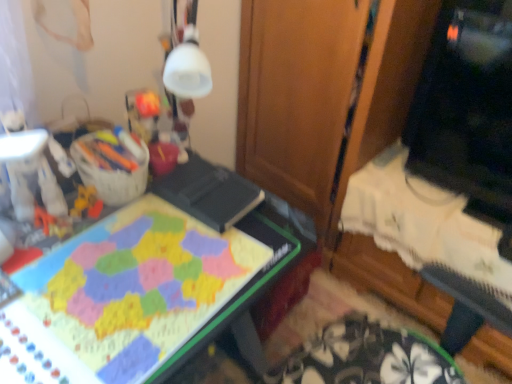
Question: Is matte plastic board game at center outside of black glossy monitor at upper right?

Choices:
 (A) no
 (B) yes

Answer: (B)

Question: Does matte plastic board game at center appear on the left side of black glossy monitor at upper right?

Choices:
 (A) no
 (B) yes

Answer: (B)

Question: From the image's perspective, is matte plastic board game at center on black glossy monitor at upper right?

Choices:
 (A) yes
 (B) no

Answer: (B)

Question: Considering the relative positions of matte plastic board game at center and black glossy monitor at upper right in the image provided, is matte plastic board game at center behind black glossy monitor at upper right?

Choices:
 (A) no
 (B) yes

Answer: (A)

Question: From a real-world perspective, does matte plastic board game at center stand above black glossy monitor at upper right?

Choices:
 (A) no
 (B) yes

Answer: (A)

Question: Choose the correct answer: Is matte plastic board game at center inside wooden at center or outside it?

Choices:
 (A) outside
 (B) inside

Answer: (A)

Question: From a real-world perspective, is matte plastic board game at center above or below wooden at center?

Choices:
 (A) above
 (B) below

Answer: (B)

Question: In terms of size, does matte plastic board game at center appear bigger or smaller than wooden at center?

Choices:
 (A) small
 (B) big

Answer: (A)

Question: Considering the positions of matte plastic board game at center and wooden at center in the image, is matte plastic board game at center wider or thinner than wooden at center?

Choices:
 (A) thin
 (B) wide

Answer: (A)

Question: Looking at their shapes, would you say plush yellow toy at left is wider or thinner than matte plastic board game at center?

Choices:
 (A) thin
 (B) wide

Answer: (A)

Question: Is plush yellow toy at left taller or shorter than matte plastic board game at center?

Choices:
 (A) short
 (B) tall

Answer: (A)

Question: Relative to matte plastic board game at center, is plush yellow toy at left in front or behind?

Choices:
 (A) front
 (B) behind

Answer: (B)

Question: Based on their positions, is plush yellow toy at left located to the left or right of matte plastic board game at center?

Choices:
 (A) left
 (B) right

Answer: (A)

Question: In terms of size, does matte plastic board game at center appear bigger or smaller than black glossy monitor at upper right?

Choices:
 (A) small
 (B) big

Answer: (B)

Question: Considering the positions of matte plastic board game at center and black glossy monitor at upper right in the image, is matte plastic board game at center taller or shorter than black glossy monitor at upper right?

Choices:
 (A) short
 (B) tall

Answer: (B)